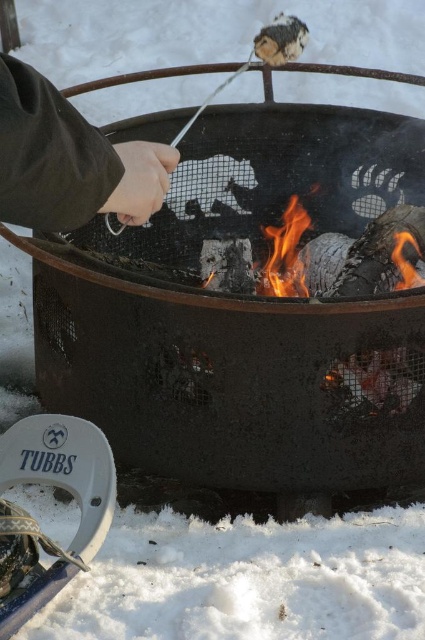
Can you confirm if rusty metal grill at center is positioned above flameliquid/gas at center?

No.

Between rusty metal grill at center and flameliquid/gas at center, which one is positioned lower?

rusty metal grill at center is below.

Who is more distant from viewer, (391,188) or (285,275)?

Point (391,188)

Where is `rusty metal grill at center`? The height and width of the screenshot is (640, 425). rusty metal grill at center is located at coordinates (246, 330).

Can you confirm if rusty metal grill at center is wider than dark green fabric at upper left?

Yes.

Is rusty metal grill at center shorter than dark green fabric at upper left?

Incorrect, rusty metal grill at center's height does not fall short of dark green fabric at upper left's.

Is point (252, 211) in front of point (59, 108)?

That is False.

The width and height of the screenshot is (425, 640). I want to click on rusty metal grill at center, so click(246, 330).

Is point (155, 179) positioned after point (286, 225)?

No, (155, 179) is closer to viewer.

Who is taller, dark green fabric at upper left or flameliquid/gas at center?

flameliquid/gas at center is taller.

Locate an element on the screen. This screenshot has height=640, width=425. dark green fabric at upper left is located at coordinates (68, 160).

Find the location of a particular element. The image size is (425, 640). dark green fabric at upper left is located at coordinates click(x=68, y=160).